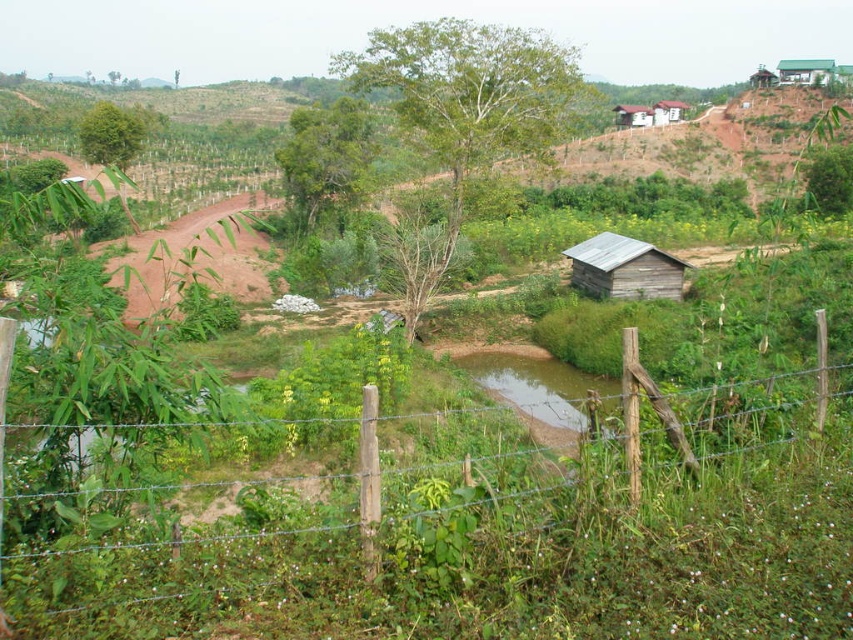
Is point (227, 568) in front of point (662, 122)?

Yes.

Is wooden post fence at lower center to the left of wooden hut at upper right from the viewer's perspective?

Indeed, wooden post fence at lower center is positioned on the left side of wooden hut at upper right.

Is point (412, 604) positioned behind point (666, 104)?

No, it is not.

Find the location of a particular element. The image size is (853, 640). wooden post fence at lower center is located at coordinates (495, 545).

Is point (666, 280) positioned before point (618, 112)?

Yes, it is in front of point (618, 112).

Who is higher up, weathered wood hut at center-right or wooden shack at upper right?

Positioned higher is wooden shack at upper right.

The image size is (853, 640). Find the location of `weathered wood hut at center-right`. weathered wood hut at center-right is located at coordinates (624, 268).

This screenshot has height=640, width=853. I want to click on weathered wood hut at center-right, so click(624, 268).

Is point (595, 289) closer to viewer compared to point (808, 58)?

Yes, point (595, 289) is closer to viewer.

Which of these two, weathered wood hut at center-right or green corrugated metal hut at upper right, stands taller?

With more height is green corrugated metal hut at upper right.

Which is behind, point (589, 289) or point (798, 76)?

Positioned behind is point (798, 76).

The image size is (853, 640). I want to click on weathered wood hut at center-right, so click(624, 268).